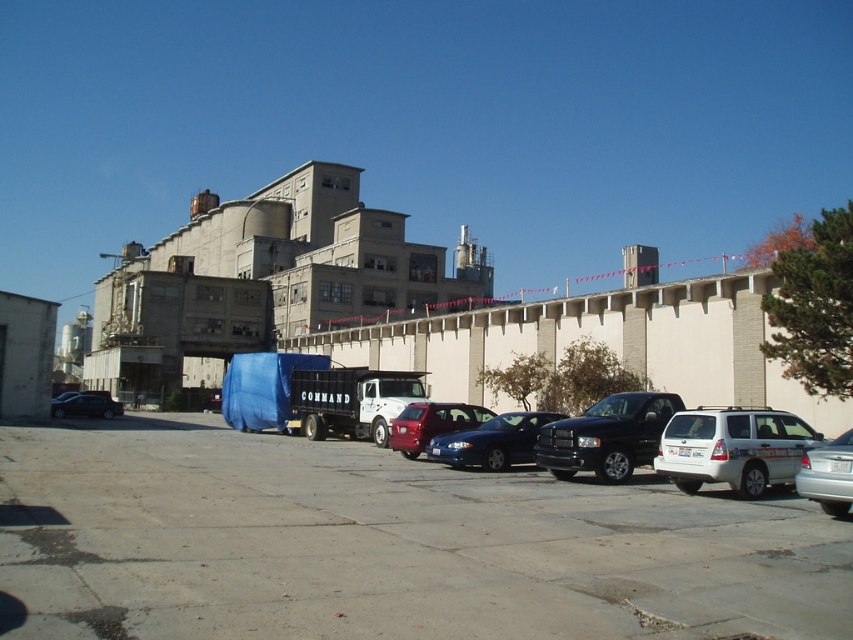
Question: Is gray concrete parking lot at center positioned in front of shiny black sedan at left?

Choices:
 (A) yes
 (B) no

Answer: (A)

Question: Among these points, which one is farthest from the camera?

Choices:
 (A) (48, 593)
 (B) (695, 442)
 (C) (527, 451)

Answer: (C)

Question: Among these objects, which one is nearest to the camera?

Choices:
 (A) shiny black sedan at left
 (B) gray concrete parking lot at center
 (C) white matte suv at center

Answer: (B)

Question: Can you confirm if glossy blue sedan at center is positioned below silver metallic sedan at lower right?

Choices:
 (A) no
 (B) yes

Answer: (B)

Question: Which object is farther from the camera taking this photo?

Choices:
 (A) white matte suv at center
 (B) shiny red sedan at center

Answer: (B)

Question: Is white matte suv at center wider than shiny black sedan at left?

Choices:
 (A) no
 (B) yes

Answer: (A)